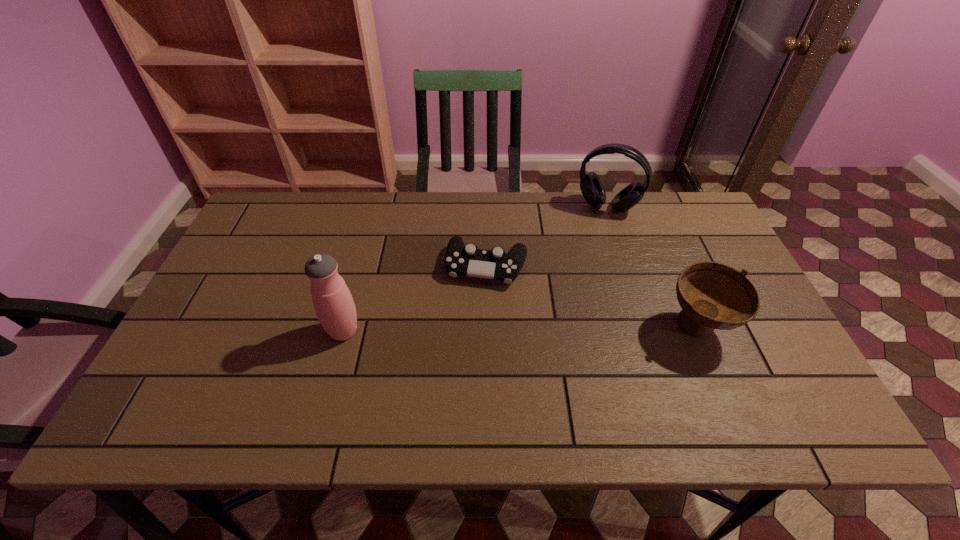
The height and width of the screenshot is (540, 960). I want to click on free spot on the desktop that is between the leftmost object and the soup bowl and is positioned on the earcups of the farthest object, so click(x=564, y=329).

At what (x,y) coordinates should I click in order to perform the action: click on free spot on the desktop that is between the leftmost object and the second shortest object and is positioned on the surface of the second farthest object. Please return your answer as a coordinate pair (x, y). Looking at the image, I should click on (472, 330).